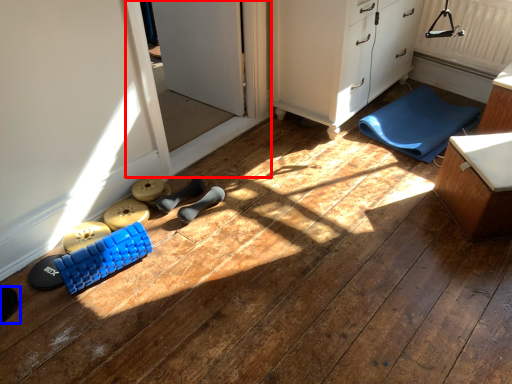
Question: Which object appears closest to the camera in this image, screen door (highlighted by a red box) or footwear (highlighted by a blue box)?

Choices:
 (A) screen door
 (B) footwear

Answer: (B)